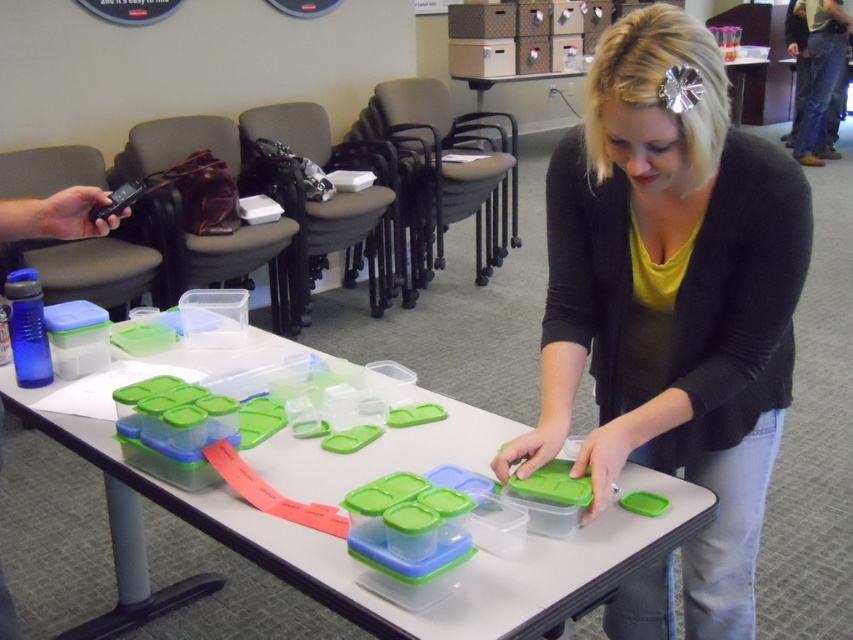
Question: Among these objects, which one is nearest to the camera?

Choices:
 (A) jeans at right
 (B) clear plastic containers at center

Answer: (B)

Question: Which object is the closest to the jeans at right?

Choices:
 (A) clear plastic containers at center
 (B) matte black sweater at center

Answer: (B)

Question: Is matte black sweater at center in front of clear plastic containers at center?

Choices:
 (A) yes
 (B) no

Answer: (B)

Question: Can you confirm if clear plastic containers at center is positioned to the right of jeans at right?

Choices:
 (A) no
 (B) yes

Answer: (A)

Question: Considering the real-world distances, which object is farthest from the jeans at right?

Choices:
 (A) clear plastic containers at center
 (B) matte black sweater at center

Answer: (A)

Question: Is matte black sweater at center positioned before clear plastic containers at center?

Choices:
 (A) no
 (B) yes

Answer: (A)